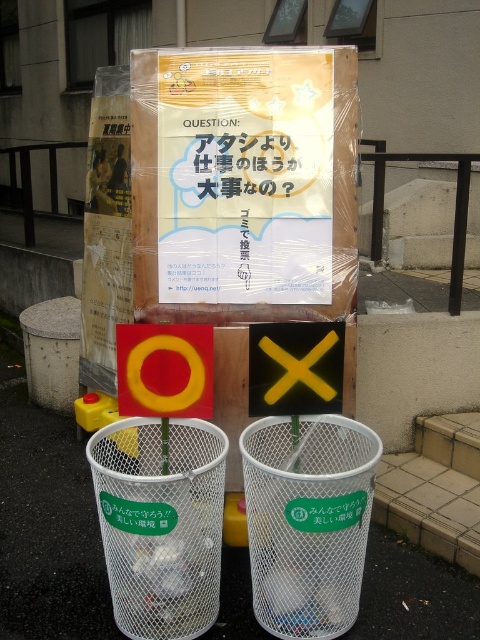
Is yellow matte circle at center wider than yellow plastic sign at center?

Yes.

Is point (145, 401) closer to camera compared to point (304, 342)?

That is True.

I want to click on yellow matte circle at center, so click(165, 371).

The height and width of the screenshot is (640, 480). What do you see at coordinates (308, 522) in the screenshot?
I see `white mesh basket at center` at bounding box center [308, 522].

Is white mesh basket at center positioned behind yellow matte circle at center?

That is False.

The width and height of the screenshot is (480, 640). What are the coordinates of `white mesh basket at center` in the screenshot? It's located at (308, 522).

Between white mesh bin at lower center and white mesh basket at center, which one appears on the right side from the viewer's perspective?

white mesh basket at center is more to the right.

Which is more to the left, white mesh bin at lower center or white mesh basket at center?

Positioned to the left is white mesh bin at lower center.

Is point (29, 520) less distant than point (290, 589)?

No, it is behind (290, 589).

In order to click on white mesh bin at lower center in this screenshot , I will do `click(47, 524)`.